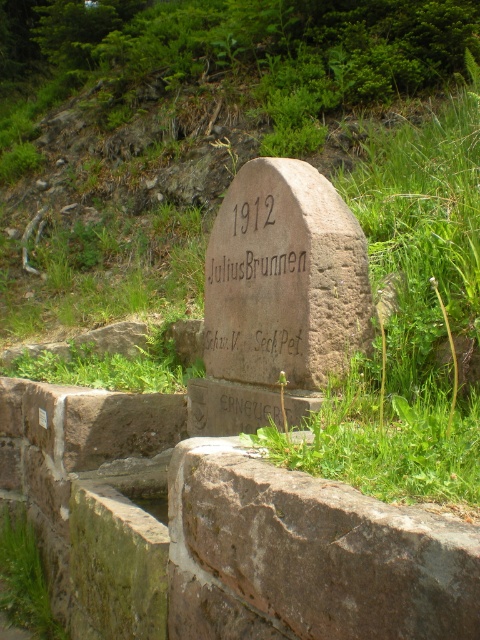
Question: Which point appears closest to the camera in this image?

Choices:
 (A) click(433, 579)
 (B) click(279, 177)
 (C) click(33, 540)

Answer: (A)

Question: Can you confirm if brown rough stone at center is bigger than green leafy grass at lower left?

Choices:
 (A) no
 (B) yes

Answer: (B)

Question: Does brown stone gravestone at center lie behind green leafy grass at lower left?

Choices:
 (A) no
 (B) yes

Answer: (A)

Question: Among these points, which one is nearest to the camera?

Choices:
 (A) (358, 518)
 (B) (35, 628)
 (C) (309, 248)

Answer: (A)

Question: Is brown stone gravestone at center positioned before green leafy grass at lower left?

Choices:
 (A) yes
 (B) no

Answer: (A)

Question: Which of the following is the farthest from the observer?

Choices:
 (A) (38, 556)
 (B) (201, 380)
 (C) (406, 544)

Answer: (A)